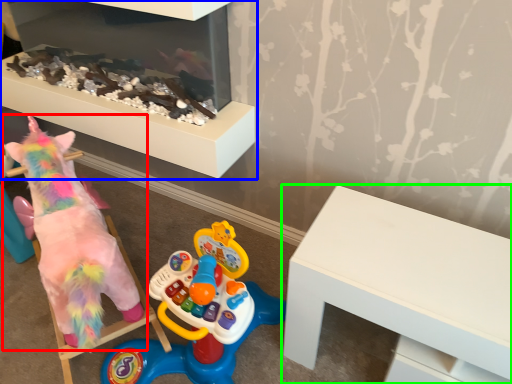
Question: Which object is the closest to the toy (highlighted by a red box)? Choose among these: furniture (highlighted by a blue box) or table (highlighted by a green box).

Choices:
 (A) furniture
 (B) table

Answer: (A)